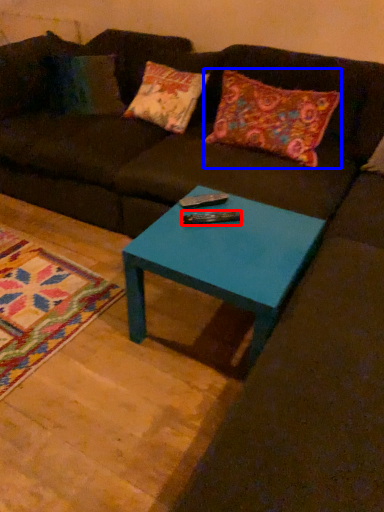
Question: Among these objects, which one is nearest to the camera, remote (highlighted by a red box) or pillow (highlighted by a blue box)?

Choices:
 (A) remote
 (B) pillow

Answer: (A)